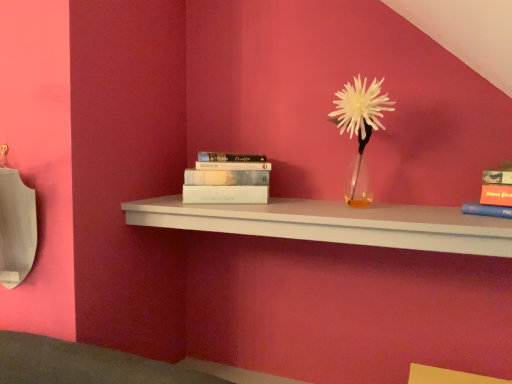
Find the location of a particular element. matte orange book at upper right, the first book from the front is located at coordinates (494, 193).

At what (x,y) coordinates should I click in order to perform the action: click on white matte flower at center. Please return your answer as a coordinate pair (x, y). Looking at the image, I should click on (360, 127).

You are a GUI agent. You are given a task and a screenshot of the screen. Output one action in this format:
    pyautogui.click(x=<x>, y=<y>)
    Task: Click on the white matte book at center, which ranks as the 1th book in back-to-front order
    Image resolution: width=512 pixels, height=384 pixels.
    Given the screenshot: What is the action you would take?
    (227, 179)

Between white matte flower at center and white matte book at center, which ranks as the 1th book in back-to-front order, which one appears on the right side from the viewer's perspective?

white matte flower at center.

Is white matte flower at center not close to white matte book at center, which ranks as the 1th book in back-to-front order?

That's not correct — white matte flower at center is a little close to white matte book at center, which ranks as the 1th book in back-to-front order.

Is point (372, 104) positioned in front of point (236, 179)?

That is True.

From a real-world perspective, which is physically below, white matte flower at center or white matte book at center, which is the 1th book from left to right?

In real-world perspective, white matte book at center, which is the 1th book from left to right, is lower.

Does white matte flower at center appear on the right side of white matte shelf at center?

Yes.

Considering the positions of objects white matte flower at center and white matte shelf at center in the image provided, who is in front, white matte flower at center or white matte shelf at center?

white matte shelf at center is closer to the camera.

Does point (362, 82) come behind point (340, 217)?

Yes, point (362, 82) is farther from viewer.

Between white matte flower at center and white matte shelf at center, which one has smaller size?

Smaller between the two is white matte flower at center.

Is the depth of white matte book at center, which is the 2th book in front-to-back order, less than that of white matte flower at center?

No, white matte book at center, which is the 2th book in front-to-back order, is further to the viewer.

From the image's perspective, is white matte book at center, which ranks as the 2th book in right-to-left order, located above white matte flower at center?

Incorrect, from the image's perspective, white matte book at center, which ranks as the 2th book in right-to-left order, is lower than white matte flower at center.

You are a GUI agent. You are given a task and a screenshot of the screen. Output one action in this format:
    pyautogui.click(x=<x>, y=<y>)
    Task: Click on the floral arrangement in front of the white matte book at center, which ranks as the 1th book in back-to-front order
    
    Given the screenshot: What is the action you would take?
    360,127

In terms of height, does white matte book at center, which is the 1th book from left to right, look taller or shorter compared to white matte flower at center?

white matte book at center, which is the 1th book from left to right, is shorter than white matte flower at center.

From a real-world perspective, does matte orange book at upper right, marked as the second book in a back-to-front arrangement, stand above white matte shelf at center?

Yes, from a real-world perspective, matte orange book at upper right, marked as the second book in a back-to-front arrangement, is on top of white matte shelf at center.

Would you say white matte shelf at center is part of matte orange book at upper right, acting as the 1th book starting from the right,'s contents?

Definitely not — white matte shelf at center is not inside matte orange book at upper right, acting as the 1th book starting from the right.

Find the location of a particular element. shelf below the matte orange book at upper right, acting as the 1th book starting from the right (from the image's perspective) is located at coordinates (334, 223).

Does point (486, 197) appear closer or farther from the camera than point (341, 217)?

Point (486, 197) is farther from the camera than point (341, 217).

Is white matte shelf at center not close to white matte book at center, which ranks as the 2th book in right-to-left order?

No, there isn't a large distance between white matte shelf at center and white matte book at center, which ranks as the 2th book in right-to-left order.

Can white matte book at center, which is the 2th book in front-to-back order, be found inside white matte shelf at center?

No.

Which is more to the right, white matte shelf at center or white matte book at center, which ranks as the 2th book in right-to-left order?

white matte shelf at center is more to the right.

Considering the relative sizes of white matte shelf at center and white matte book at center, which ranks as the 1th book in back-to-front order, in the image provided, is white matte shelf at center shorter than white matte book at center, which ranks as the 1th book in back-to-front order,?

Yes.

At what (x,y) coordinates should I click in order to perform the action: click on book that appears on the right of white matte flower at center. Please return your answer as a coordinate pair (x, y). Image resolution: width=512 pixels, height=384 pixels. Looking at the image, I should click on (494, 193).

Is white matte flower at center taller or shorter than matte orange book at upper right, the first book from the front?

Considering their sizes, white matte flower at center has more height than matte orange book at upper right, the first book from the front.

Could you tell me if white matte flower at center is facing matte orange book at upper right, the first book from the front?

No.

Is white matte shelf at center placed right next to white matte flower at center?

No.

Which is more to the right, white matte shelf at center or white matte flower at center?

From the viewer's perspective, white matte flower at center appears more on the right side.

Based on the photo, how many degrees apart are the facing directions of white matte shelf at center and white matte flower at center?

white matte shelf at center and white matte flower at center are facing 1.06 degrees away from each other.

Is point (416, 228) closer to camera compared to point (360, 168)?

Yes.

At what (x,y) coordinates should I click in order to perform the action: click on floral arrangement above the white matte book at center, which is the 1th book from left to right (from the image's perspective). Please return your answer as a coordinate pair (x, y). Looking at the image, I should click on (360, 127).

In the image, there is a white matte flower at center. Where is `shelf below it (from the image's perspective)`? shelf below it (from the image's perspective) is located at coordinates (x=334, y=223).

Looking at the image, which one is located further to white matte book at center, which is the 2th book in front-to-back order, matte orange book at upper right, the first book from the front, or white matte shelf at center?

matte orange book at upper right, the first book from the front.

Which object lies nearer to the anchor point white matte shelf at center, white matte flower at center or white matte book at center, which ranks as the 2th book in right-to-left order?

white matte book at center, which ranks as the 2th book in right-to-left order, lies closer to white matte shelf at center than the other object.

Which object lies nearer to the anchor point white matte shelf at center, matte orange book at upper right, acting as the 1th book starting from the right, or white matte book at center, which ranks as the 1th book in back-to-front order?

white matte book at center, which ranks as the 1th book in back-to-front order.

Which object lies further to the anchor point matte orange book at upper right, the first book from the front, white matte shelf at center or white matte flower at center?

Based on the image, white matte flower at center appears to be further to matte orange book at upper right, the first book from the front.

From the image, which object appears to be nearer to white matte shelf at center, white matte flower at center or matte orange book at upper right, acting as the 1th book starting from the right?

white matte flower at center is closer to white matte shelf at center.

Considering their positions, is white matte shelf at center positioned further to white matte flower at center than white matte book at center, which is the 2th book in front-to-back order?

white matte book at center, which is the 2th book in front-to-back order, is further to white matte flower at center.

Estimate the real-world distances between objects in this image. Which object is further from matte orange book at upper right, acting as the 1th book starting from the right, white matte flower at center or white matte book at center, which is the 2th book in front-to-back order?

white matte book at center, which is the 2th book in front-to-back order, is positioned further to the anchor matte orange book at upper right, acting as the 1th book starting from the right.

Which object lies further to the anchor point white matte flower at center, white matte book at center, which is the 1th book from left to right, or white matte shelf at center?

Among the two, white matte book at center, which is the 1th book from left to right, is located further to white matte flower at center.

Locate an element on the screen. This screenshot has height=384, width=512. floral arrangement located between white matte book at center, which is the 2th book in front-to-back order, and matte orange book at upper right, marked as the second book in a back-to-front arrangement, in the left-right direction is located at coordinates (360, 127).

Locate an element on the screen. Image resolution: width=512 pixels, height=384 pixels. shelf between white matte book at center, which ranks as the 2th book in right-to-left order, and white matte flower at center is located at coordinates (334, 223).

The height and width of the screenshot is (384, 512). I want to click on shelf between white matte book at center, which is the 1th book from left to right, and matte orange book at upper right, the first book from the front, from left to right, so click(334, 223).

The width and height of the screenshot is (512, 384). I want to click on floral arrangement situated between white matte shelf at center and matte orange book at upper right, the second book positioned from the left, from left to right, so click(x=360, y=127).